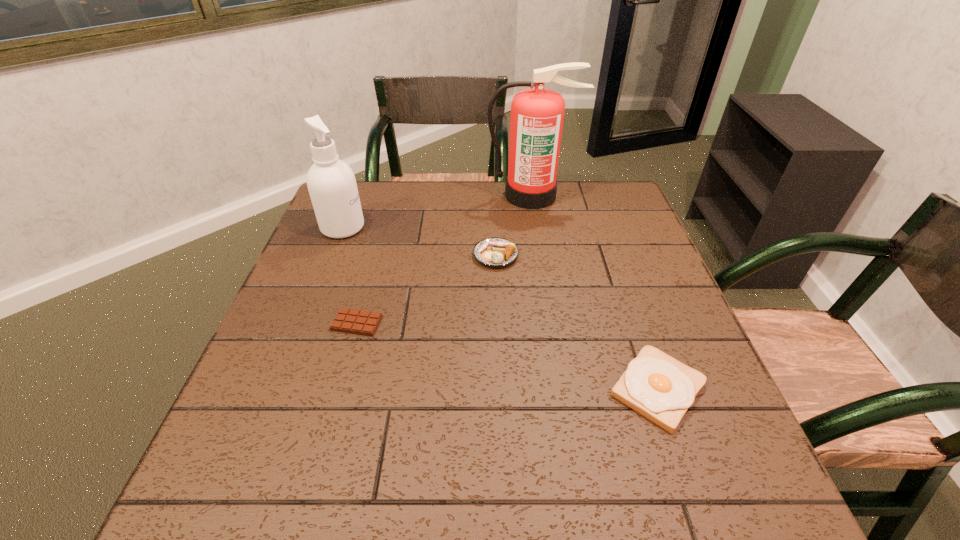
I want to click on vacant space that satisfies the following two spatial constraints: 1. at the nozzle of the tallest object; 2. on the left side of the toast, so click(563, 389).

The height and width of the screenshot is (540, 960). Find the location of `free location that satisfies the following two spatial constraints: 1. on the front label of the cleansing agent; 2. on the right side of the nearest object`. free location that satisfies the following two spatial constraints: 1. on the front label of the cleansing agent; 2. on the right side of the nearest object is located at coordinates (279, 389).